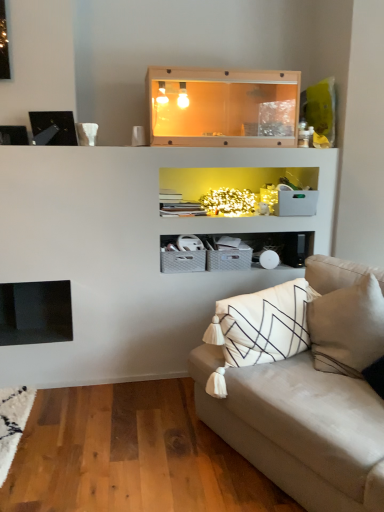
Question: Are beige fabric couch at lower right and wooden tank at upper center far apart?

Choices:
 (A) no
 (B) yes

Answer: (B)

Question: Considering the relative sizes of beige fabric couch at lower right and wooden tank at upper center in the image provided, is beige fabric couch at lower right wider than wooden tank at upper center?

Choices:
 (A) yes
 (B) no

Answer: (A)

Question: Is beige fabric couch at lower right thinner than wooden tank at upper center?

Choices:
 (A) yes
 (B) no

Answer: (B)

Question: Would you say beige fabric couch at lower right contains wooden tank at upper center?

Choices:
 (A) yes
 (B) no

Answer: (B)

Question: Can you confirm if beige fabric couch at lower right is shorter than wooden tank at upper center?

Choices:
 (A) no
 (B) yes

Answer: (A)

Question: Can we say beige fabric couch at lower right lies outside wooden tank at upper center?

Choices:
 (A) no
 (B) yes

Answer: (B)

Question: Is the surface of wooden tank at upper center in direct contact with beige fabric couch at lower right?

Choices:
 (A) no
 (B) yes

Answer: (A)

Question: Considering the relative sizes of wooden tank at upper center and beige fabric couch at lower right in the image provided, is wooden tank at upper center bigger than beige fabric couch at lower right?

Choices:
 (A) no
 (B) yes

Answer: (A)

Question: Is beige fabric couch at lower right at the back of wooden tank at upper center?

Choices:
 (A) yes
 (B) no

Answer: (B)

Question: From the image's perspective, is wooden tank at upper center on beige fabric couch at lower right?

Choices:
 (A) yes
 (B) no

Answer: (A)

Question: Can you confirm if wooden tank at upper center is wider than beige fabric couch at lower right?

Choices:
 (A) no
 (B) yes

Answer: (A)

Question: Can you confirm if wooden tank at upper center is taller than beige fabric couch at lower right?

Choices:
 (A) no
 (B) yes

Answer: (A)

Question: Is wooden tank at upper center bigger or smaller than beige fabric couch at lower right?

Choices:
 (A) small
 (B) big

Answer: (A)